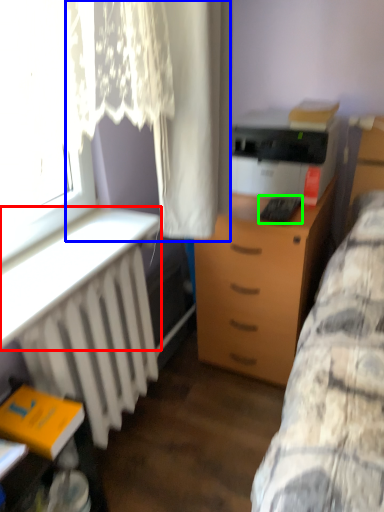
Question: Which object is the closest to the table (highlighted by a red box)? Choose among these: curtain (highlighted by a blue box) or equipment (highlighted by a green box).

Choices:
 (A) curtain
 (B) equipment

Answer: (A)